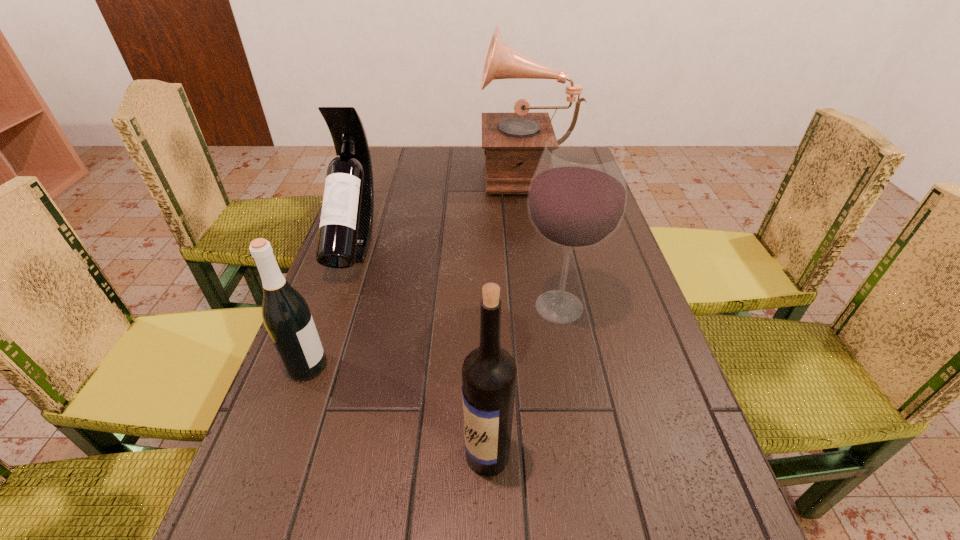
Where is `the farthest object`? the farthest object is located at coordinates (513, 143).

Locate an element on the screen. Image resolution: width=960 pixels, height=540 pixels. alcohol is located at coordinates (577, 197).

Find the location of a particular element. This screenshot has width=960, height=540. the rightmost wine bottle is located at coordinates (489, 372).

You are a GUI agent. You are given a task and a screenshot of the screen. Output one action in this format:
    pyautogui.click(x=<x>, y=<y>)
    Task: Click on the nearest object
    The height and width of the screenshot is (540, 960).
    Given the screenshot: What is the action you would take?
    pyautogui.click(x=489, y=372)

You are a GUI agent. You are given a task and a screenshot of the screen. Output one action in this format:
    pyautogui.click(x=<x>, y=<y>)
    Task: Click on the farthest wine bottle
    
    Given the screenshot: What is the action you would take?
    pyautogui.click(x=345, y=231)

This screenshot has height=540, width=960. I want to click on the second nearest wine bottle, so click(286, 315).

In order to click on free space located on the horn of the farthest object in this screenshot , I will do `click(402, 171)`.

At what (x,y) coordinates should I click in order to perform the action: click on free location located on the horn of the farthest object. Please return your answer as a coordinate pair (x, y). This screenshot has width=960, height=540. Looking at the image, I should click on (435, 171).

Locate an element on the screen. The height and width of the screenshot is (540, 960). vacant space located on the horn of the farthest object is located at coordinates (382, 171).

You are a GUI agent. You are given a task and a screenshot of the screen. Output one action in this format:
    pyautogui.click(x=<x>, y=<y>)
    Task: Click on the free space located 0.110m on the right of the alcohol
    The image size is (960, 540).
    Given the screenshot: What is the action you would take?
    pyautogui.click(x=648, y=307)